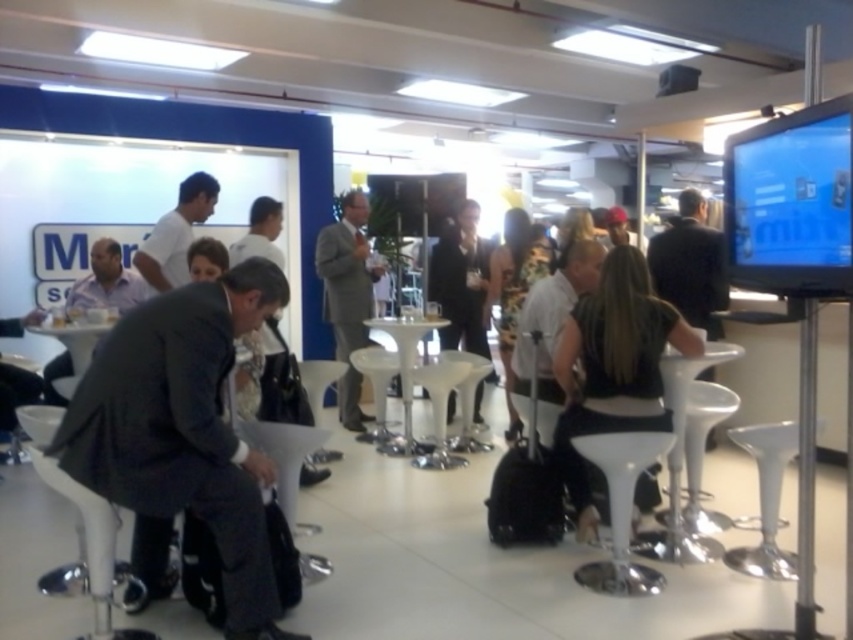
Question: Which point is closer to the camera taking this photo?

Choices:
 (A) (651, 458)
 (B) (468, 342)

Answer: (A)

Question: Can you confirm if dark gray suit at left is positioned below white plastic bar stool at lower left?

Choices:
 (A) no
 (B) yes

Answer: (A)

Question: Among these objects, which one is farthest from the camera?

Choices:
 (A) dark gray suit at left
 (B) black fabric dress at center
 (C) white plastic bar stool at lower center
 (D) white plastic bar stool at lower left

Answer: (B)

Question: Does white plastic bar stool at lower center appear over white plastic bar stool at lower left?

Choices:
 (A) yes
 (B) no

Answer: (A)

Question: Is dark gray suit at left below white plastic bar stool at lower center?

Choices:
 (A) no
 (B) yes

Answer: (A)

Question: Among these points, which one is nearest to the camera?

Choices:
 (A) (329, 276)
 (B) (219, 518)
 (C) (305, 380)
 (D) (619, 289)

Answer: (B)